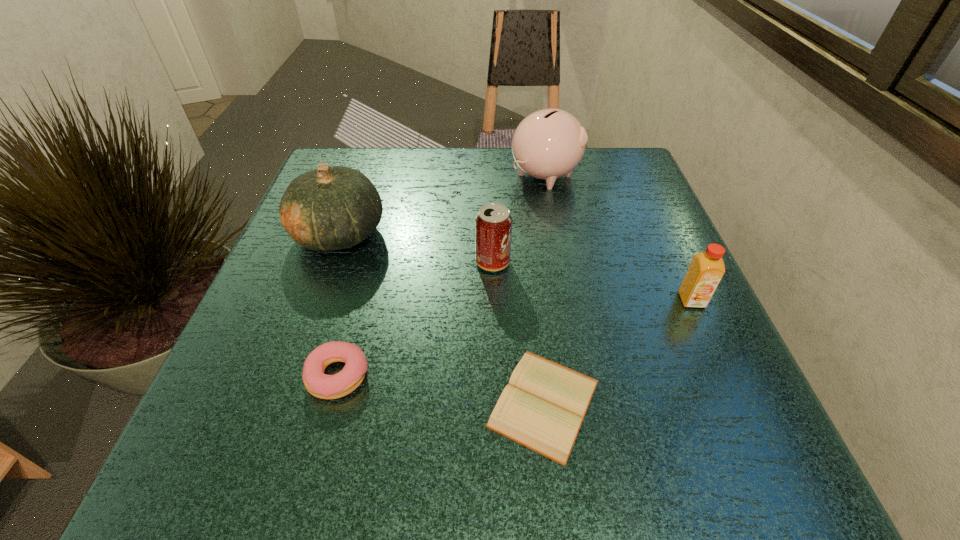
Locate an element on the screen. This screenshot has width=960, height=540. free area in between the piggy bank and the soda can is located at coordinates (519, 219).

The height and width of the screenshot is (540, 960). I want to click on vacant space that's between the shortest object and the farthest object, so click(x=544, y=289).

Identify the location of vacant space that's between the piggy bank and the soda can. (519, 219).

Find the location of a particular element. The width and height of the screenshot is (960, 540). vacant region between the orange juice and the soda can is located at coordinates (592, 281).

Where is `vacant space in between the gourd and the soda can`? The image size is (960, 540). vacant space in between the gourd and the soda can is located at coordinates (417, 248).

Find the location of a particular element. The height and width of the screenshot is (540, 960). vacant space that's between the shortest object and the piggy bank is located at coordinates (544, 289).

Locate an element on the screen. object that stands as the fourth closest to the soda can is located at coordinates (318, 384).

Locate an element on the screen. Image resolution: width=960 pixels, height=540 pixels. object that ranks as the second closest to the soda can is located at coordinates (329, 208).

Locate an element on the screen. vacant region that satisfies the following two spatial constraints: 1. on the front side of the diary; 2. on the right side of the doughnut is located at coordinates (331, 403).